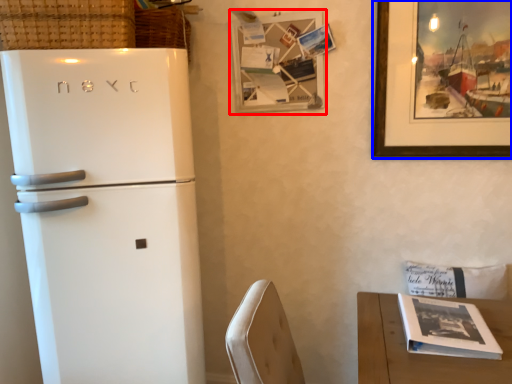
Question: Which point is further to the camera, picture frame (highlighted by a red box) or picture frame (highlighted by a blue box)?

Choices:
 (A) picture frame
 (B) picture frame

Answer: (A)